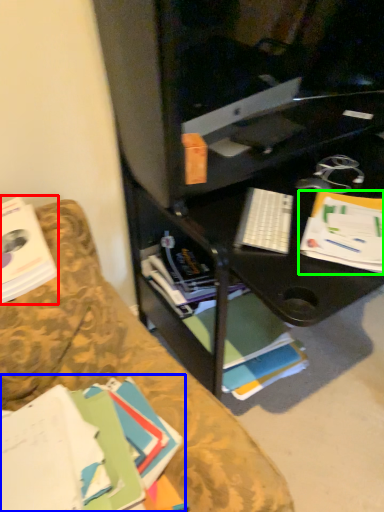
Question: Based on their relative distances, which object is nearer to book (highlighted by a red box)? Choose from book (highlighted by a blue box) and paperback book (highlighted by a green box).

Choices:
 (A) book
 (B) paperback book

Answer: (A)